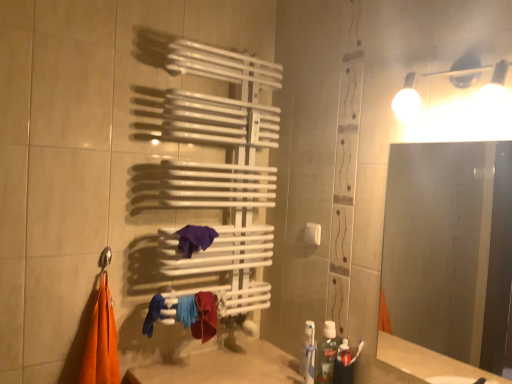
Question: Would you say blue fabric at lower center is a long distance from frosted glass mirror at right?

Choices:
 (A) yes
 (B) no

Answer: (A)

Question: Is blue fabric at lower center looking in the opposite direction of frosted glass mirror at right?

Choices:
 (A) yes
 (B) no

Answer: (B)

Question: From a real-world perspective, is blue fabric at lower center physically below frosted glass mirror at right?

Choices:
 (A) no
 (B) yes

Answer: (B)

Question: From a real-world perspective, is blue fabric at lower center on frosted glass mirror at right?

Choices:
 (A) yes
 (B) no

Answer: (B)

Question: Is blue fabric at lower center thinner than frosted glass mirror at right?

Choices:
 (A) no
 (B) yes

Answer: (A)

Question: Relative to blue fabric at lower center, is white plastic towel bar at center in front or behind?

Choices:
 (A) behind
 (B) front

Answer: (A)

Question: Considering the positions of white plastic towel bar at center and blue fabric at lower center in the image, is white plastic towel bar at center taller or shorter than blue fabric at lower center?

Choices:
 (A) short
 (B) tall

Answer: (A)

Question: From the image's perspective, is white plastic towel bar at center above or below blue fabric at lower center?

Choices:
 (A) below
 (B) above

Answer: (B)

Question: In terms of size, does white plastic towel bar at center appear bigger or smaller than blue fabric at lower center?

Choices:
 (A) small
 (B) big

Answer: (A)

Question: From the image's perspective, is translucent plastic toothpaste at lower right positioned above or below frosted glass mirror at right?

Choices:
 (A) above
 (B) below

Answer: (B)

Question: Is translucent plastic toothpaste at lower right taller or shorter than frosted glass mirror at right?

Choices:
 (A) tall
 (B) short

Answer: (B)

Question: Based on their positions, is translucent plastic toothpaste at lower right located to the left or right of frosted glass mirror at right?

Choices:
 (A) left
 (B) right

Answer: (A)

Question: Considering the positions of translucent plastic toothpaste at lower right and frosted glass mirror at right in the image, is translucent plastic toothpaste at lower right bigger or smaller than frosted glass mirror at right?

Choices:
 (A) big
 (B) small

Answer: (B)

Question: Which is correct: translucent plastic toothpaste at lower right is inside blue fabric at lower center, or outside of it?

Choices:
 (A) outside
 (B) inside

Answer: (A)

Question: From a real-world perspective, relative to blue fabric at lower center, is translucent plastic toothpaste at lower right vertically above or below?

Choices:
 (A) below
 (B) above

Answer: (A)